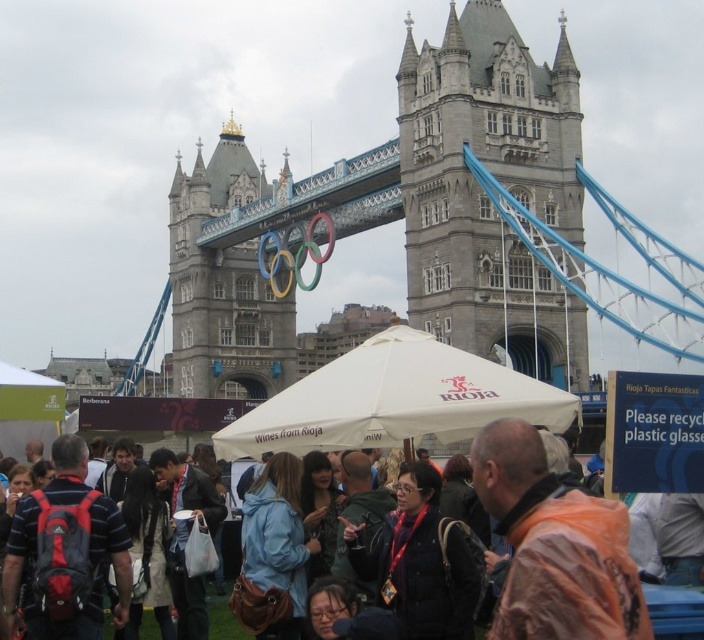
Question: Can you confirm if stone gray tower at center is smaller than striped fabric shirt at center?

Choices:
 (A) no
 (B) yes

Answer: (A)

Question: Which point appears farthest from the camera in this image?

Choices:
 (A) (455, 285)
 (B) (80, 550)

Answer: (A)

Question: Which point is closer to the camera?

Choices:
 (A) striped fabric shirt at center
 (B) stone gray tower at center
 (C) matte black backpack at lower left

Answer: (C)

Question: Where is stone gothic tower at center located in relation to orange fabric jacket at lower right in the image?

Choices:
 (A) below
 (B) above

Answer: (B)

Question: Which point is farther to the camera?

Choices:
 (A) (358, 435)
 (B) (515, 493)
 (C) (448, 24)

Answer: (C)

Question: Is stone gothic tower at center smaller than orange fabric jacket at lower right?

Choices:
 (A) yes
 (B) no

Answer: (B)